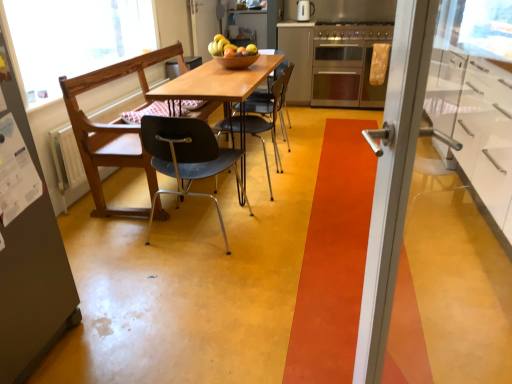
Where is `free space above orange carpet at center (from a real-world perspective)`? This screenshot has height=384, width=512. free space above orange carpet at center (from a real-world perspective) is located at coordinates (350, 208).